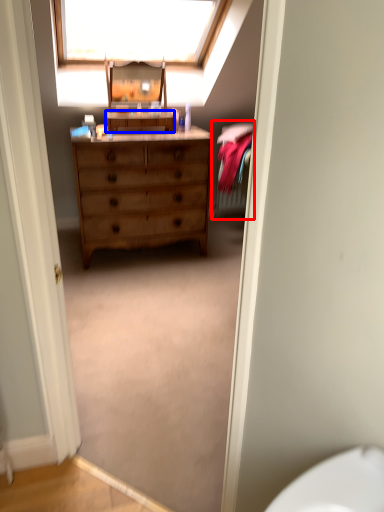
Question: Which of the following is the closest to the observer, bed (highlighted by a red box) or cabinetry (highlighted by a blue box)?

Choices:
 (A) bed
 (B) cabinetry

Answer: (B)